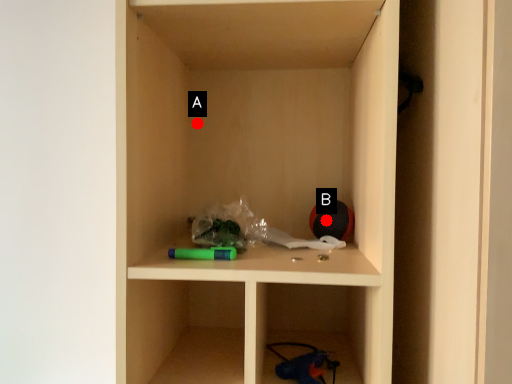
Question: Two points are circled on the image, labeled by A and B beside each circle. Which point is closer to the camera?

Choices:
 (A) A is closer
 (B) B is closer

Answer: (B)